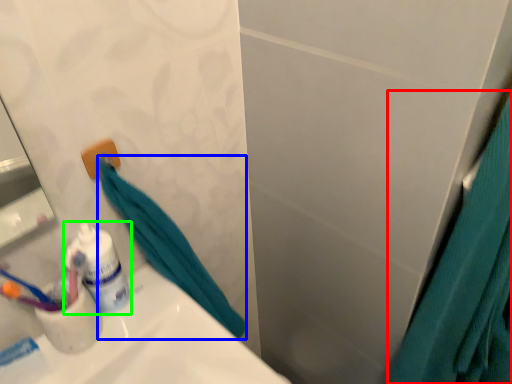
Question: Which object is positioned closest to shower curtain (highlighted by a red box)? Select from bath towel (highlighted by a blue box) and toiletry (highlighted by a green box).

Choices:
 (A) bath towel
 (B) toiletry

Answer: (A)